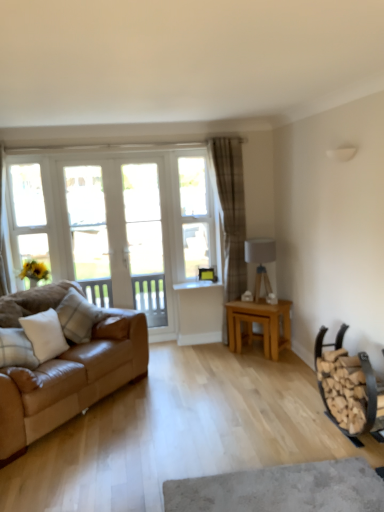
At what (x,y) coordinates should I click in order to perform the action: click on vacant space in front of light brown wooden table at center. Please return your answer as a coordinate pair (x, y). Looking at the image, I should click on (266, 368).